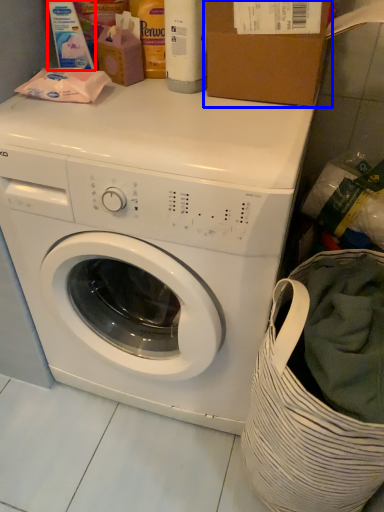
Question: Which object appears closest to the camera in this image, cleaning product (highlighted by a red box) or cardboard box (highlighted by a blue box)?

Choices:
 (A) cleaning product
 (B) cardboard box

Answer: (B)